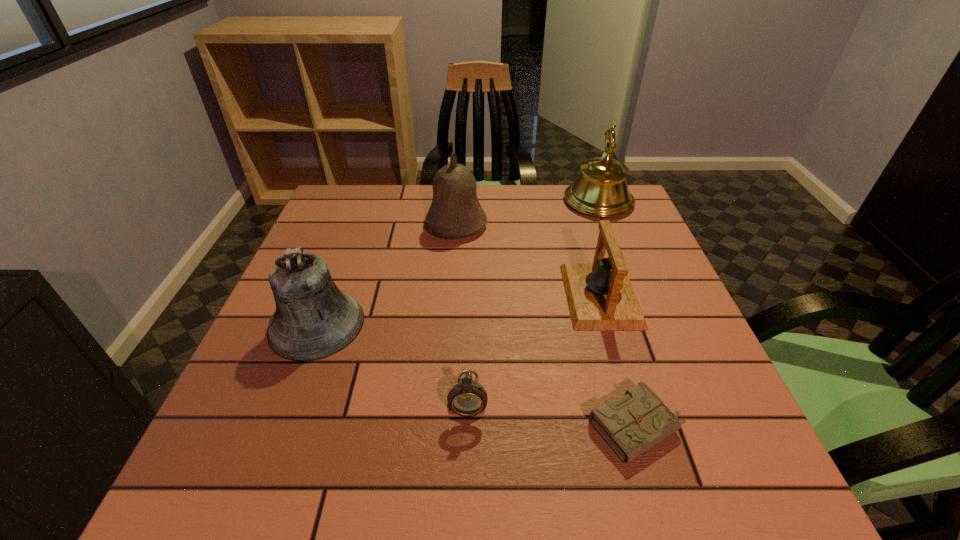
The image size is (960, 540). I want to click on the second bell from left to right, so click(x=455, y=213).

Locate an element on the screen. The width and height of the screenshot is (960, 540). the leftmost bell is located at coordinates (313, 320).

The height and width of the screenshot is (540, 960). Identify the location of the fourth tallest object. click(600, 297).

Locate an element on the screen. the second shortest object is located at coordinates (468, 398).

Find the location of a particular element. Image resolution: width=960 pixels, height=540 pixels. the shortest object is located at coordinates (633, 424).

Locate an element on the screen. The height and width of the screenshot is (540, 960). vacant region located 0.160m on the front of the second bell from left to right is located at coordinates (452, 284).

In order to click on blank area located 0.180m on the back of the leftmost object in this screenshot , I will do `click(347, 246)`.

In order to click on free region located on the back of the shortest bell in this screenshot , I will do `click(578, 221)`.

Identify the location of blank space located 0.060m on the face of the fifth tallest object. (467, 456).

Find the location of a particular element. This screenshot has width=960, height=540. vacant space situated 0.360m on the back of the diary is located at coordinates coord(591,268).